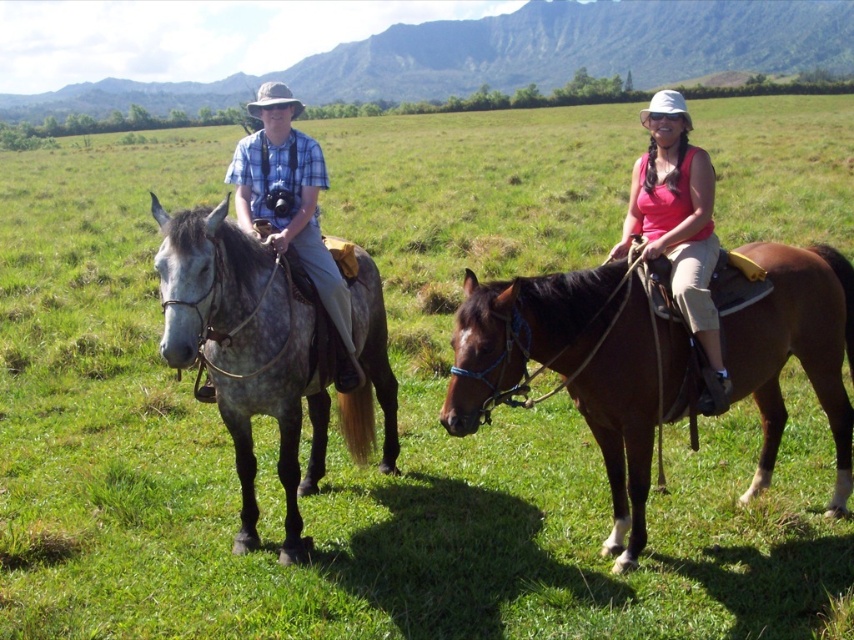
You are a photographer standing in the field and want to take a photo of both the matte pink tank top at center and the matte blue plaid shirt at left. Which rider should you focus on first to ensure both are in clear focus?

You should focus on the matte blue plaid shirt at left first because it is farther away than the matte pink tank top at center, so adjusting focus from far to near ensures both are in clear focus.

You are a photographer trying to capture both the matte pink tank top at center and the matte blue plaid shirt at left in a single frame. Since the camera has a limited focus range, you need to know which clothing item is wider to ensure proper framing. Which one has a greater width?

The matte pink tank top at center has a greater width than the matte blue plaid shirt at left according to the description.

You are standing in the grassy field and see two points marked in the image. Which point is closer to you, point (x=162, y=308) or point (x=681, y=106)?

Point (x=162, y=308) is closer to the viewer than point (x=681, y=106).